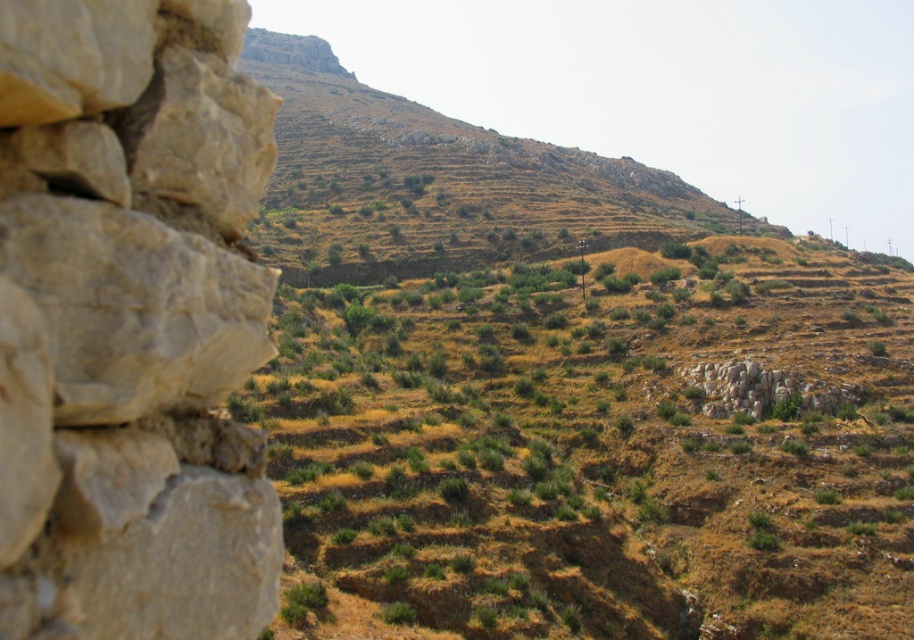
In the scene shown: Is natural beige stone at left below brown textured hill at upper center?

Yes, natural beige stone at left is below brown textured hill at upper center.

Between natural beige stone at left and brown textured hill at upper center, which one has more height?

brown textured hill at upper center

Measure the distance between point (153, 141) and camera.

Point (153, 141) is 6.59 meters from camera.

This screenshot has width=914, height=640. Find the location of `natural beige stone at left`. natural beige stone at left is located at coordinates (131, 323).

Between green grassy field at center and natural beige stone at left, which one has less height?

Standing shorter between the two is natural beige stone at left.

Does green grassy field at center have a lesser height compared to natural beige stone at left?

No, green grassy field at center is not shorter than natural beige stone at left.

Locate an element on the screen. This screenshot has height=640, width=914. green grassy field at center is located at coordinates (598, 460).

This screenshot has width=914, height=640. I want to click on green grassy field at center, so click(598, 460).

Is green grassy field at center wider than brown textured hill at upper center?

No, green grassy field at center is not wider than brown textured hill at upper center.

Does green grassy field at center appear on the left side of brown textured hill at upper center?

No, green grassy field at center is not to the left of brown textured hill at upper center.

The image size is (914, 640). I want to click on green grassy field at center, so click(598, 460).